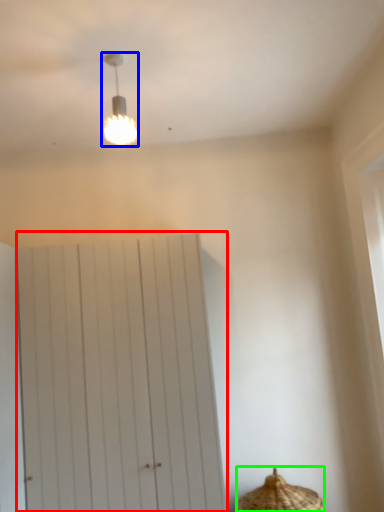
Question: Which is nearer to the barn door (highlighted by a red box)? lamp (highlighted by a blue box) or basket (highlighted by a green box).

Choices:
 (A) lamp
 (B) basket

Answer: (B)